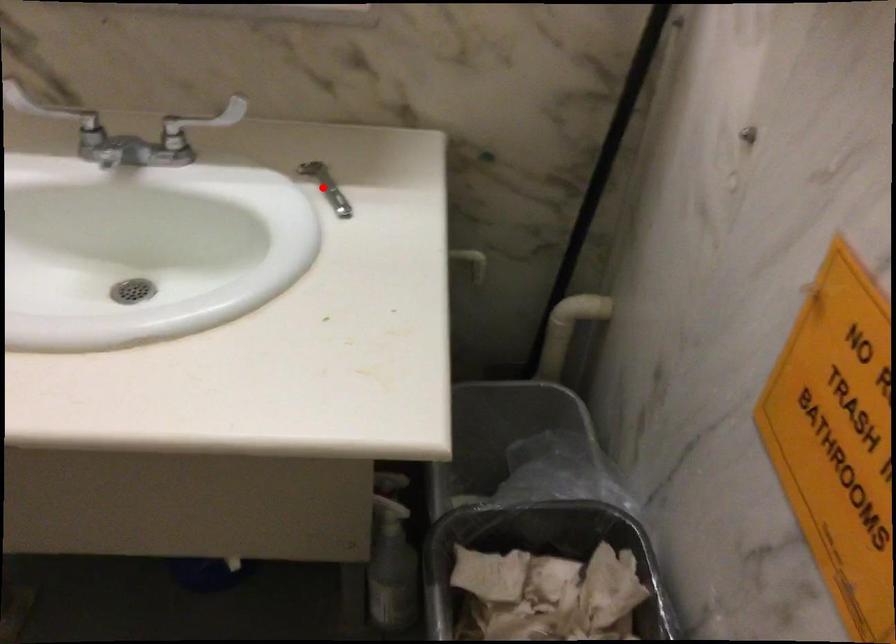
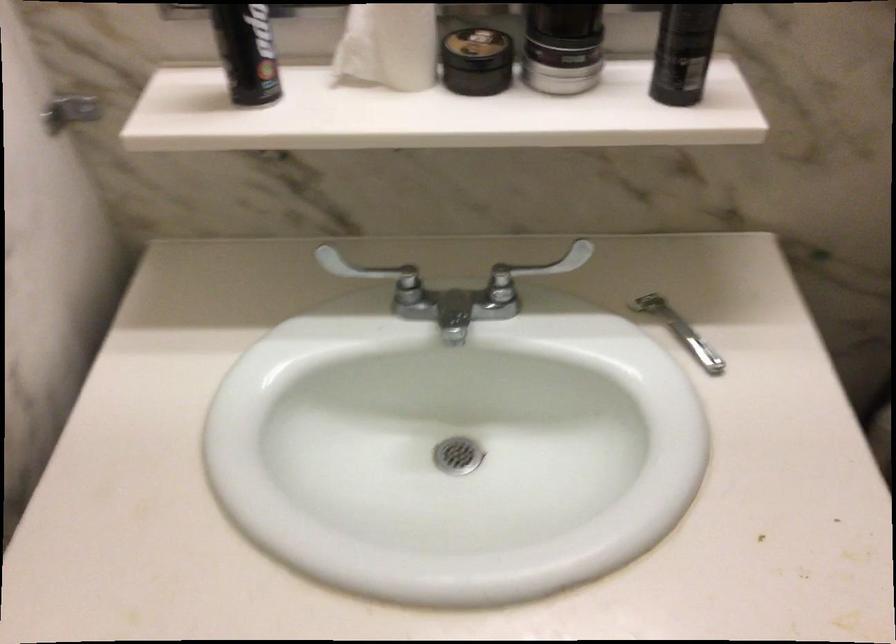
Question: I am providing you with two images of the same scene from different viewpoints. A red point is shown in image1. For the corresponding object point in image2, is it positioned nearer or farther from the camera?

Choices:
 (A) Nearer
 (B) Farther

Answer: (A)